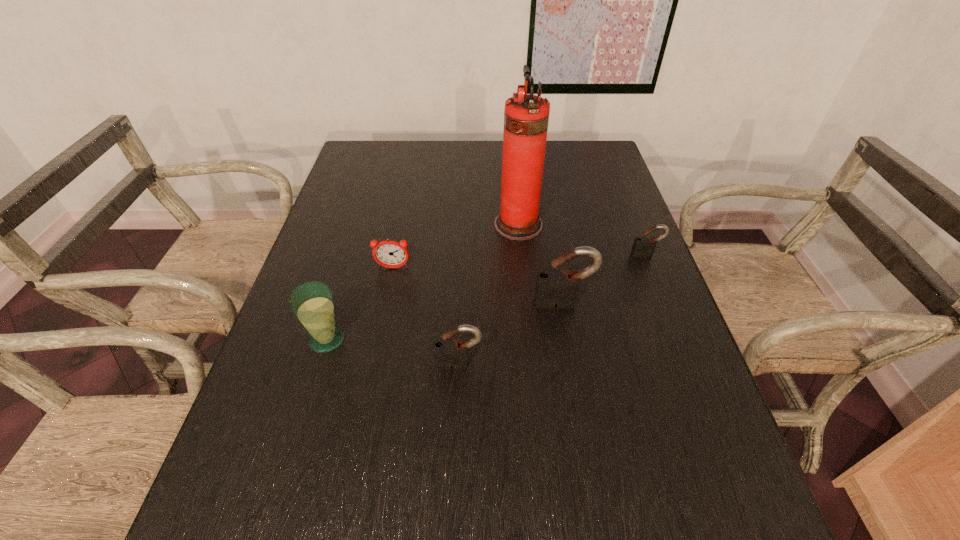
Point out which padlock is positioned as the third nearest to the third farthest object. Please provide its 2D coordinates. Your answer should be formatted as a tuple, i.e. [(x, y)], where the tuple contains the x and y coordinates of a point satisfying the conditions above.

[(642, 245)]

This screenshot has height=540, width=960. Find the location of `vacant area in the image that satisfies the following two spatial constraints: 1. at the discharge end of the tallest object; 2. with the keyhole on the front of the third shortest object`. vacant area in the image that satisfies the following two spatial constraints: 1. at the discharge end of the tallest object; 2. with the keyhole on the front of the third shortest object is located at coordinates (532, 363).

The image size is (960, 540). Identify the location of vacant space that satisfies the following two spatial constraints: 1. at the discharge end of the tallest object; 2. on the front side of the second nearest object. (530, 340).